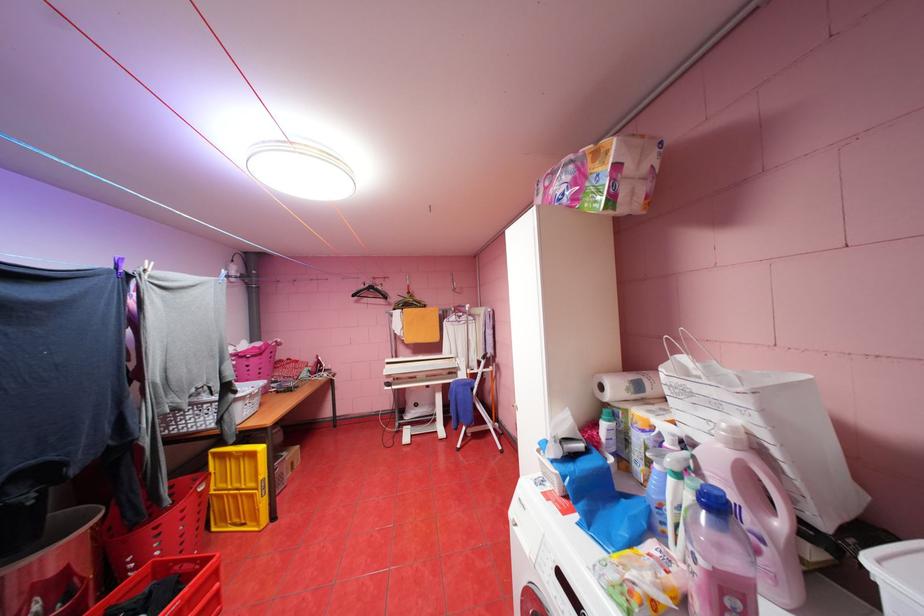
Locate an element on the screen. The width and height of the screenshot is (924, 616). purple bottle cap is located at coordinates (714, 513).